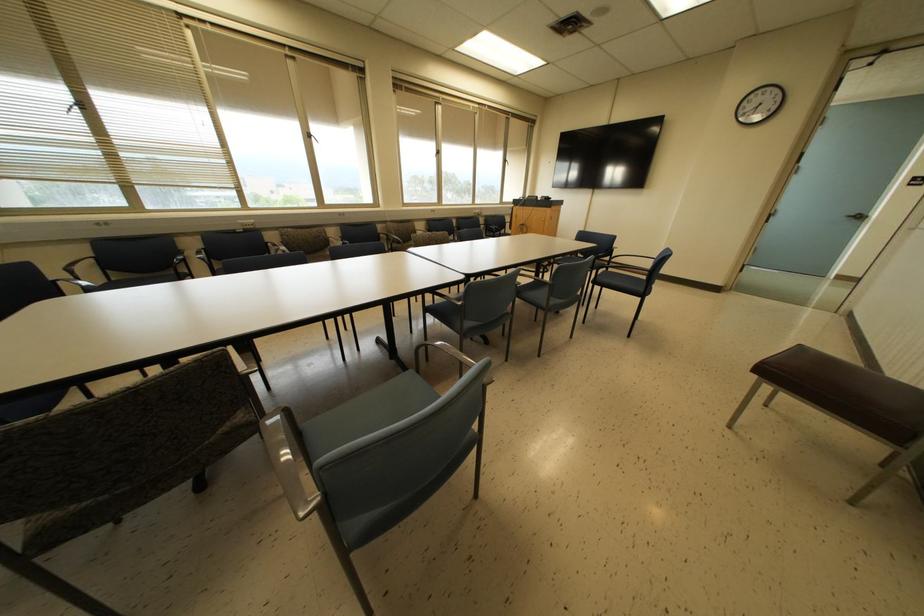
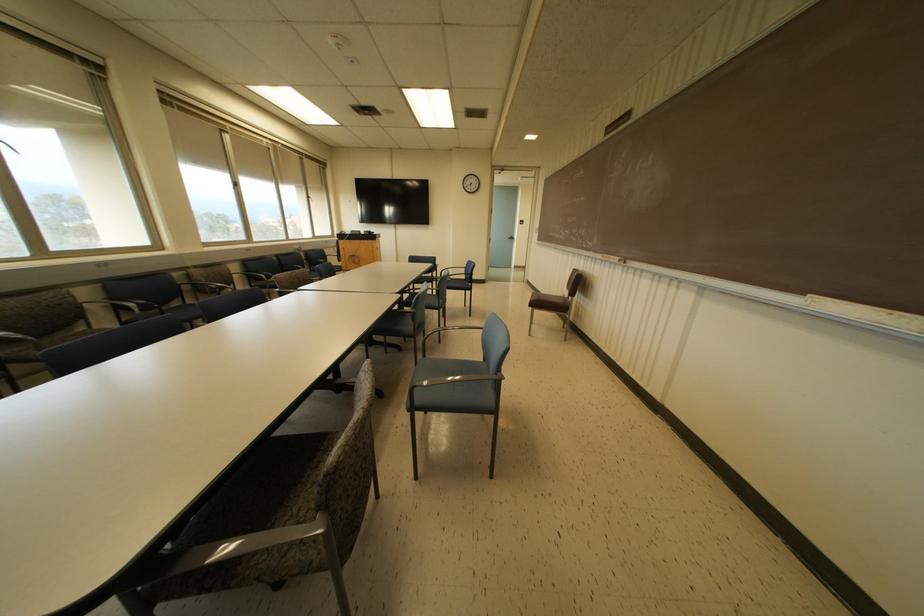
The point at (807, 377) is marked in the first image. Where is the corresponding point in the second image?

(540, 302)